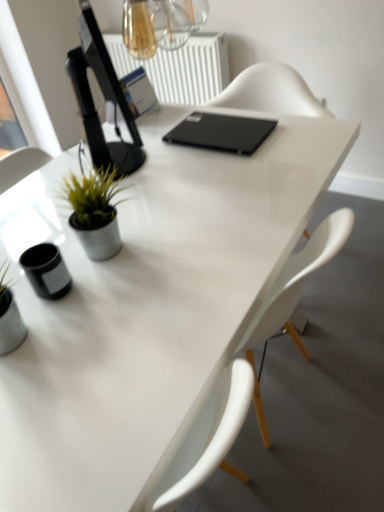
Find the location of a particular element. The image size is (384, 512). vacant area to the left of black matte laptop at center is located at coordinates (150, 152).